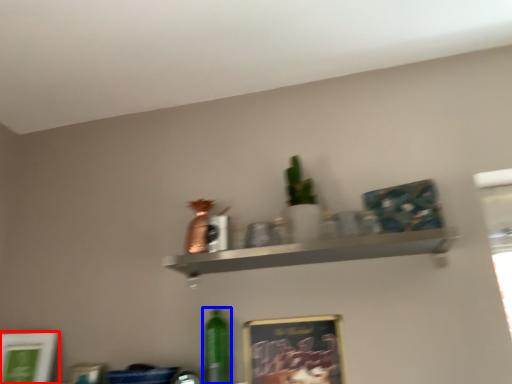
Question: Which object is closer to the camera taking this photo, picture frame (highlighted by a red box) or bottle (highlighted by a blue box)?

Choices:
 (A) picture frame
 (B) bottle

Answer: (A)